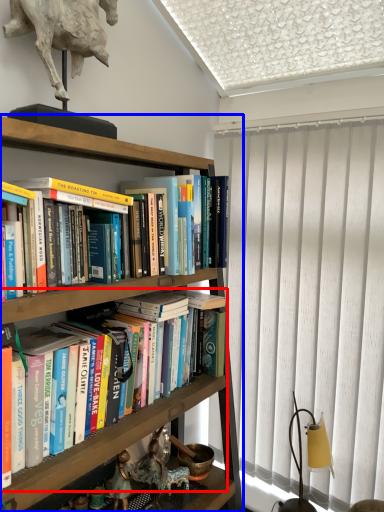
Question: Which object appears closest to the camera in this image, book (highlighted by a red box) or shelf (highlighted by a blue box)?

Choices:
 (A) book
 (B) shelf

Answer: (B)